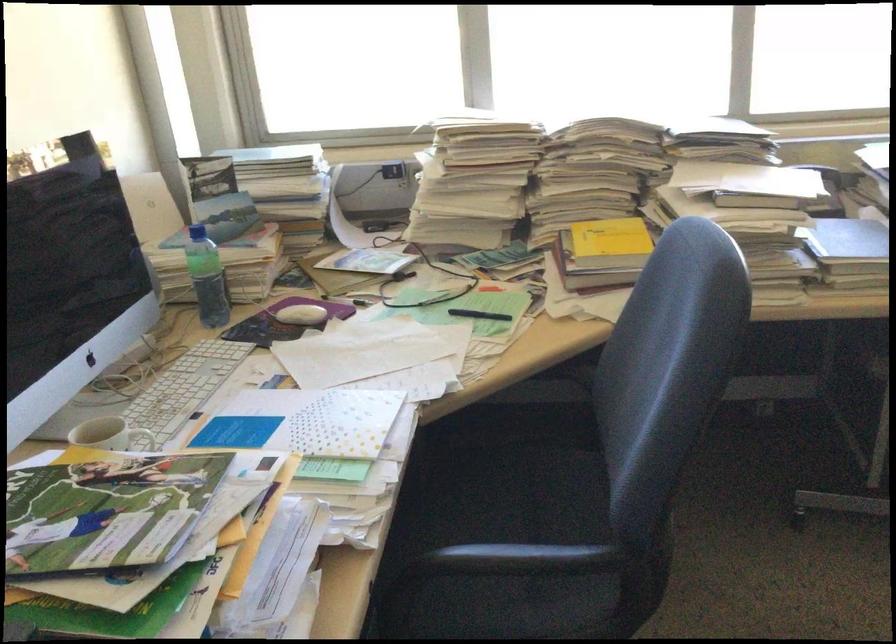
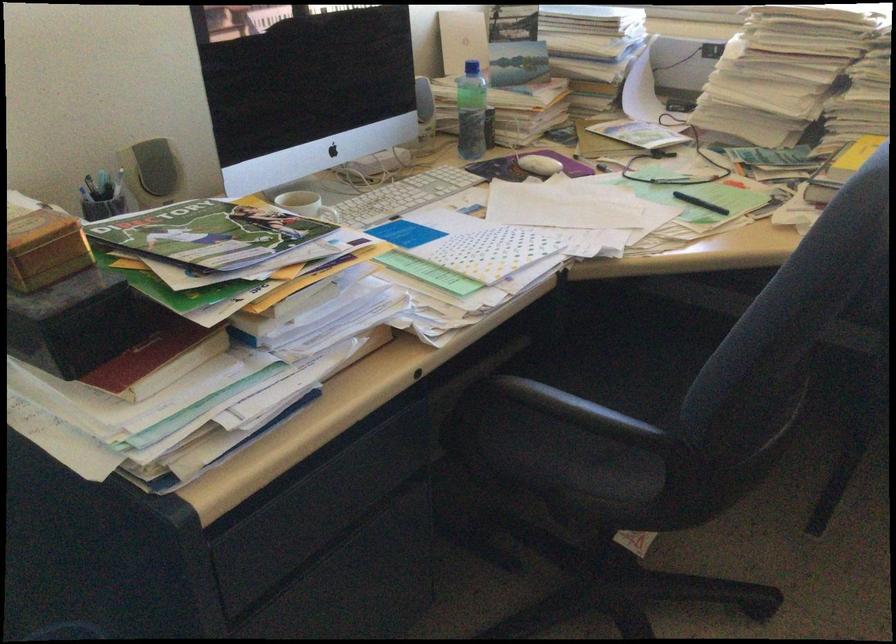
Find the pixel in the second image that matches (119,436) in the first image.

(334, 216)